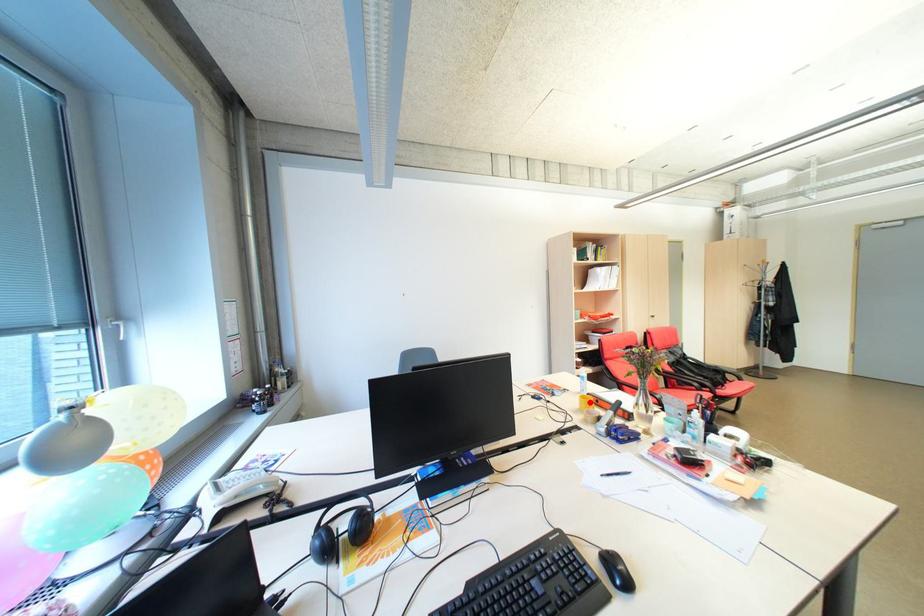
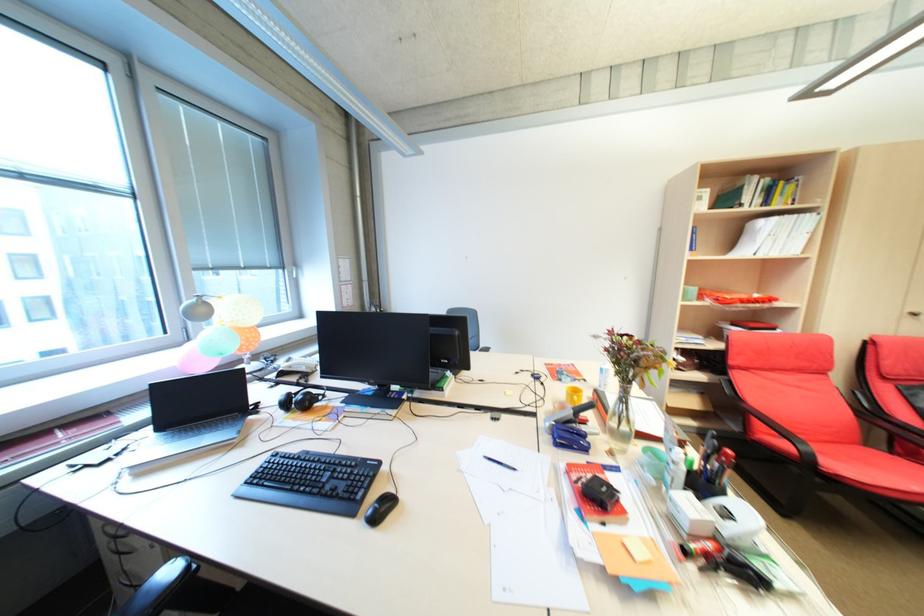
Where in the second image is the point corresponding to the highlighted location from the first image?

(577, 392)